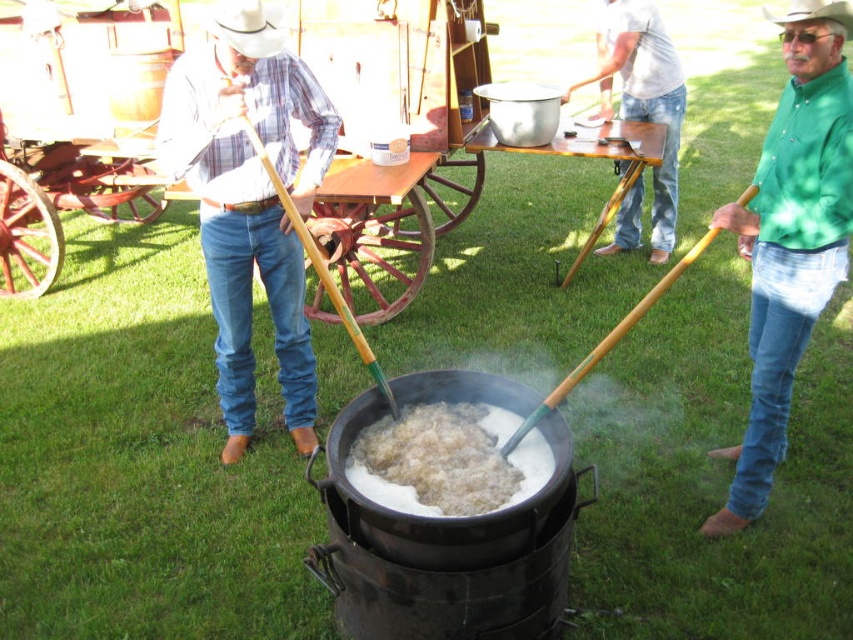
This screenshot has height=640, width=853. What do you see at coordinates (788, 250) in the screenshot?
I see `green matte shirt at right` at bounding box center [788, 250].

Which of these two, green matte shirt at right or white fluffy food at center, stands taller?

With more height is green matte shirt at right.

Describe the element at coordinates (788, 250) in the screenshot. I see `green matte shirt at right` at that location.

Image resolution: width=853 pixels, height=640 pixels. Find the location of `green matte shirt at right`. green matte shirt at right is located at coordinates (788, 250).

Can you confirm if wooden shovel at right is wider than white felt cowboy hat at upper center?

Yes.

Does wooden shovel at right appear on the left side of white felt cowboy hat at upper center?

Correct, you'll find wooden shovel at right to the left of white felt cowboy hat at upper center.

What do you see at coordinates (606, 342) in the screenshot?
I see `wooden shovel at right` at bounding box center [606, 342].

Where is `wooden shovel at right`? The image size is (853, 640). wooden shovel at right is located at coordinates point(606,342).

In the scene shown: Which of these two, matte plaid shirt at center or green wood shovel at left, stands shorter?

Standing shorter between the two is green wood shovel at left.

Does matte plaid shirt at center have a smaller size compared to green wood shovel at left?

Actually, matte plaid shirt at center might be larger than green wood shovel at left.

Which is behind, point (276, 28) or point (361, 358)?

Positioned behind is point (361, 358).

Identify the location of matte plaid shirt at center. This screenshot has height=640, width=853. (248, 200).